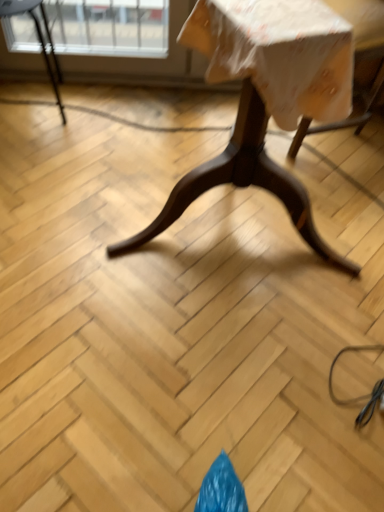
Question: Is wooden swivel chair at upper right smaller than wooden table at center?

Choices:
 (A) no
 (B) yes

Answer: (B)

Question: Does wooden swivel chair at upper right have a greater width compared to wooden table at center?

Choices:
 (A) yes
 (B) no

Answer: (B)

Question: Is wooden swivel chair at upper right turned away from wooden table at center?

Choices:
 (A) yes
 (B) no

Answer: (B)

Question: Are wooden swivel chair at upper right and wooden table at center located far from each other?

Choices:
 (A) no
 (B) yes

Answer: (A)

Question: Can you confirm if wooden swivel chair at upper right is thinner than wooden table at center?

Choices:
 (A) yes
 (B) no

Answer: (A)

Question: From a real-world perspective, is wooden swivel chair at upper right above or below wooden table at center?

Choices:
 (A) above
 (B) below

Answer: (B)

Question: In terms of width, does wooden swivel chair at upper right look wider or thinner when compared to wooden table at center?

Choices:
 (A) thin
 (B) wide

Answer: (A)

Question: Relative to wooden table at center, is wooden swivel chair at upper right in front or behind?

Choices:
 (A) behind
 (B) front

Answer: (A)

Question: Is point (297, 137) positioned closer to the camera than point (319, 22)?

Choices:
 (A) closer
 (B) farther

Answer: (B)

Question: Looking at the image, does wooden table at center seem bigger or smaller compared to metallic black chair at upper left?

Choices:
 (A) big
 (B) small

Answer: (A)

Question: Visually, is wooden table at center positioned to the left or to the right of metallic black chair at upper left?

Choices:
 (A) left
 (B) right

Answer: (B)

Question: From a real-world perspective, is wooden table at center above or below metallic black chair at upper left?

Choices:
 (A) below
 (B) above

Answer: (B)

Question: Is wooden table at center spatially inside metallic black chair at upper left, or outside of it?

Choices:
 (A) inside
 (B) outside

Answer: (B)

Question: Is wooden table at center in front of or behind wooden swivel chair at upper right in the image?

Choices:
 (A) behind
 (B) front

Answer: (B)

Question: In terms of height, does wooden table at center look taller or shorter compared to wooden swivel chair at upper right?

Choices:
 (A) short
 (B) tall

Answer: (B)